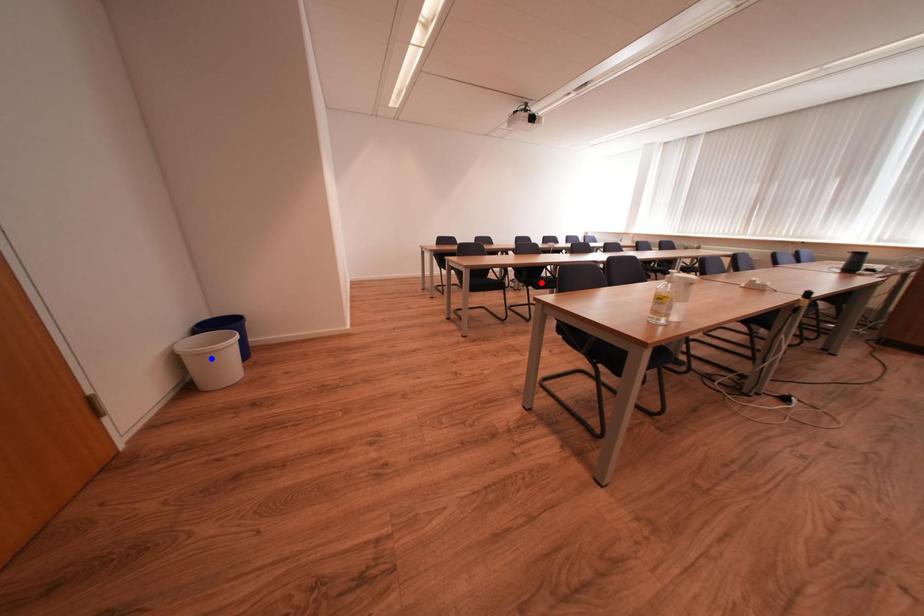
Question: In the image, two points are highlighted. Which point is nearer to the camera? Reply with the corresponding letter.

Choices:
 (A) blue point
 (B) red point

Answer: (A)